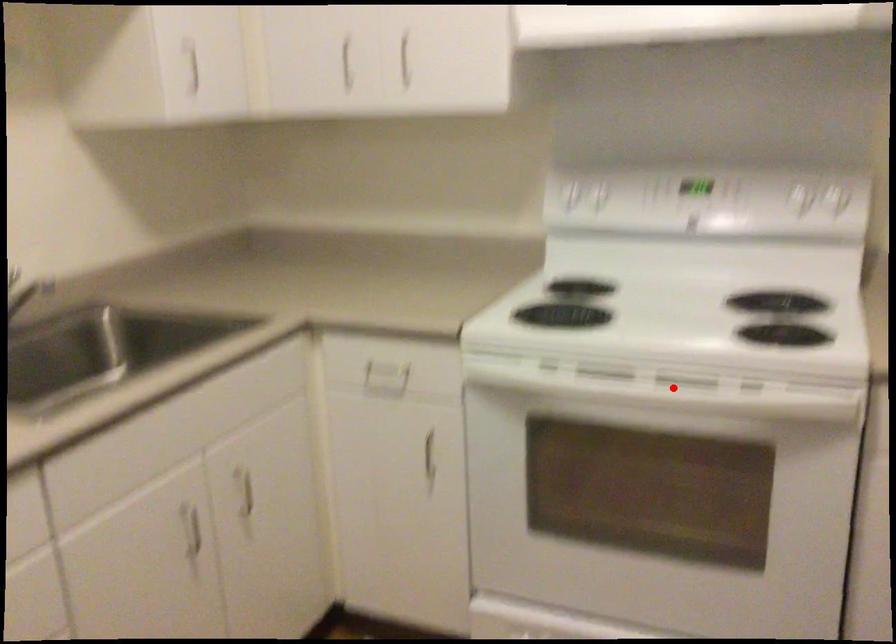
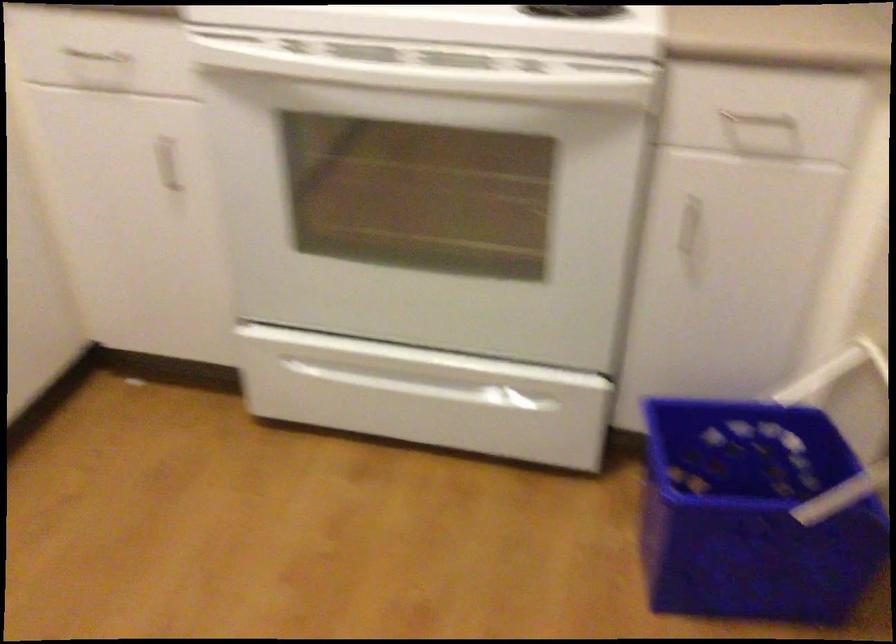
Locate, in the second image, the point that corresponds to the highlighted location in the first image.

(437, 77)